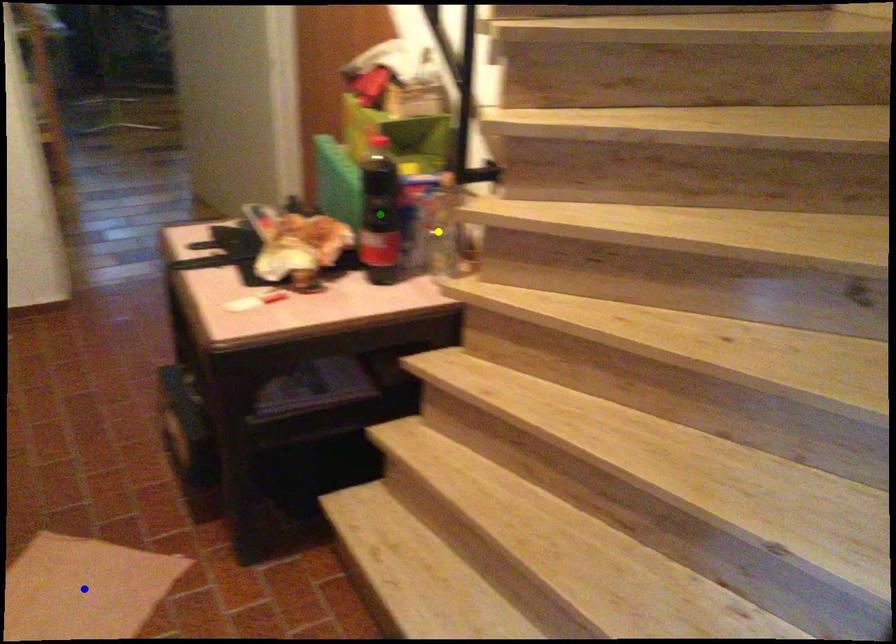
Order these from nearest to farthest:
yellow point | blue point | green point

blue point, green point, yellow point